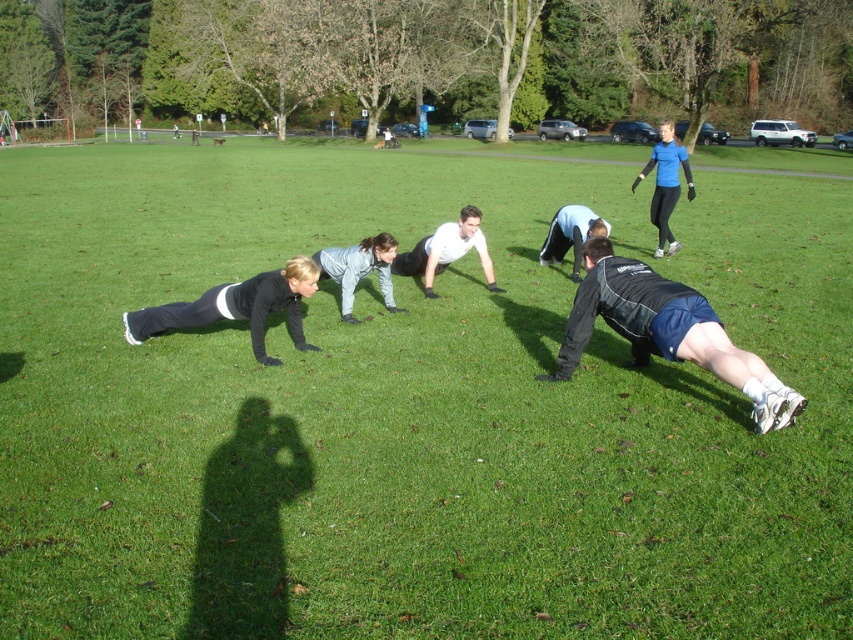
Who is higher up, gray fleece jacket at center or light blue fabric shirt at center?

light blue fabric shirt at center is higher up.

Who is positioned more to the left, gray fleece jacket at center or light blue fabric shirt at center?

From the viewer's perspective, gray fleece jacket at center appears more on the left side.

Is point (386, 240) closer to viewer compared to point (560, 244)?

Yes, point (386, 240) is closer to viewer.

You are a GUI agent. You are given a task and a screenshot of the screen. Output one action in this format:
    pyautogui.click(x=<x>, y=<y>)
    Task: Click on the gray fleece jacket at center
    The height and width of the screenshot is (640, 853).
    Given the screenshot: What is the action you would take?
    pyautogui.click(x=358, y=269)

Does white matte shirt at center have a lesser width compared to blue matte jacket at upper right?

Yes, white matte shirt at center is thinner than blue matte jacket at upper right.

In order to click on white matte shirt at center in this screenshot , I will do `click(445, 252)`.

Measure the distance between blue matte jacket at upper right and light blue fabric shirt at center.

A distance of 9.39 feet exists between blue matte jacket at upper right and light blue fabric shirt at center.

Does point (654, 157) come closer to viewer compared to point (584, 218)?

No, it is not.

Locate an element on the screen. blue matte jacket at upper right is located at coordinates (666, 184).

The height and width of the screenshot is (640, 853). I want to click on blue matte jacket at upper right, so click(x=666, y=184).